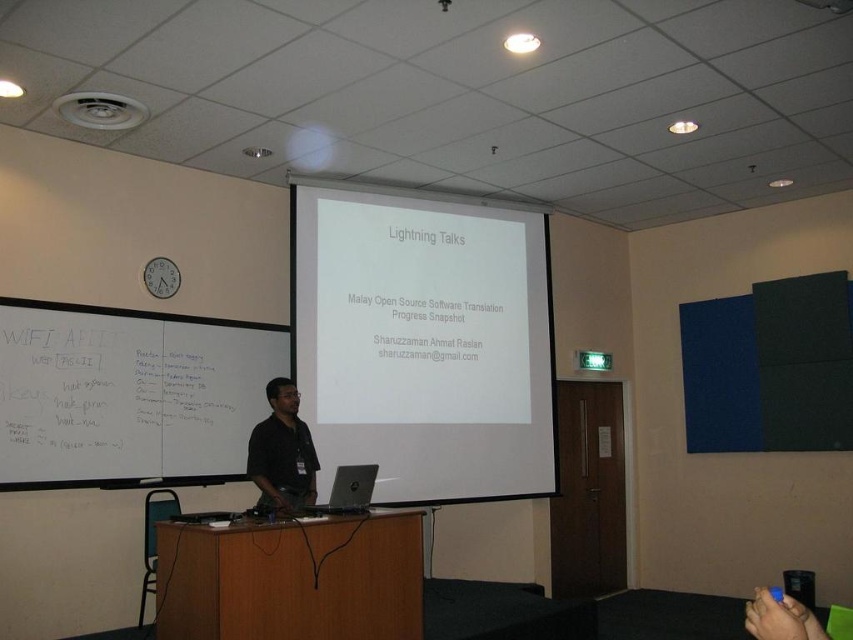
Question: Which is nearer to the matte black shirt at center?

Choices:
 (A) silver metallic laptop at center
 (B) whiteboard at left

Answer: (A)

Question: Does whiteboard at left appear over brown wood podium at center?

Choices:
 (A) yes
 (B) no

Answer: (A)

Question: Which of these objects is positioned farthest from the white matte projection screen at center?

Choices:
 (A) silver metallic laptop at center
 (B) whiteboard at left
 (C) brown wood podium at center
 (D) matte black shirt at center

Answer: (C)

Question: Does white matte projection screen at center have a greater width compared to matte black shirt at center?

Choices:
 (A) yes
 (B) no

Answer: (A)

Question: Estimate the real-world distances between objects in this image. Which object is closer to the silver metallic laptop at center?

Choices:
 (A) white matte projection screen at center
 (B) whiteboard at left
 (C) matte black shirt at center

Answer: (C)

Question: Is white matte projection screen at center to the left of whiteboard at left from the viewer's perspective?

Choices:
 (A) no
 (B) yes

Answer: (A)